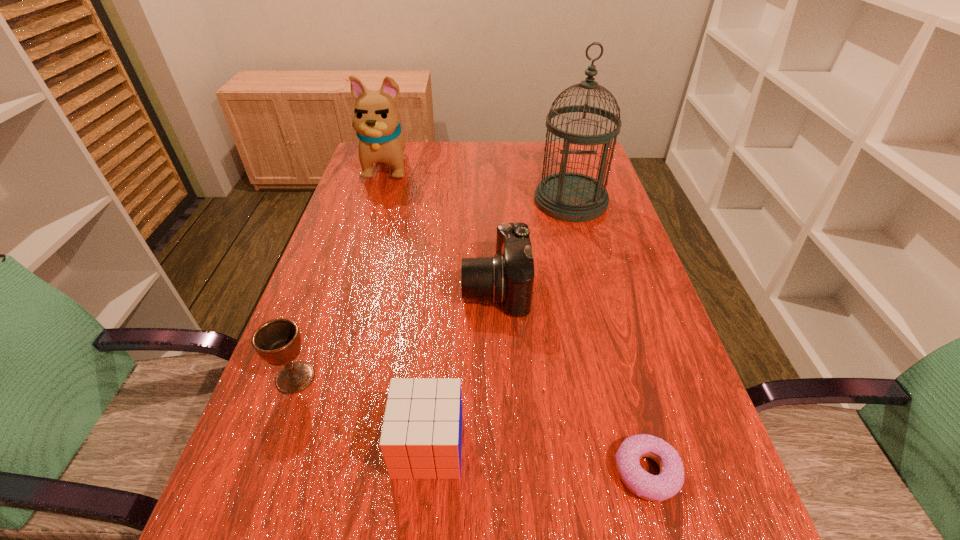
This screenshot has height=540, width=960. Find the location of `vacant space at the far edge`. vacant space at the far edge is located at coordinates (419, 162).

I want to click on vacant space at the left edge of the desktop, so click(283, 440).

At what (x,y) coordinates should I click in order to perform the action: click on vacant space at the right edge of the desktop. Please return your answer as a coordinate pair (x, y). Image resolution: width=960 pixels, height=540 pixels. Looking at the image, I should click on (594, 237).

Identify the location of vacant area that lies between the camera and the cube. (462, 367).

Find the location of a particular element. free space that is in between the cube and the third nearest object is located at coordinates (362, 411).

At what (x,y) coordinates should I click in order to perform the action: click on vacant space in between the third nearest object and the third farthest object. Please return your answer as a coordinate pair (x, y). Looking at the image, I should click on (396, 333).

The image size is (960, 540). Identify the location of free space between the fourth farthest object and the cube. (362, 411).

Where is `empty location between the doughnut and the chalice`? This screenshot has height=540, width=960. empty location between the doughnut and the chalice is located at coordinates (471, 425).

In order to click on empty space that is in between the chalice and the tallest object in this screenshot , I will do `click(433, 289)`.

At what (x,y) coordinates should I click in order to perform the action: click on vacant area that lies between the third farthest object and the tallest object. Please return your answer as a coordinate pair (x, y). This screenshot has width=960, height=540. Looking at the image, I should click on click(533, 244).